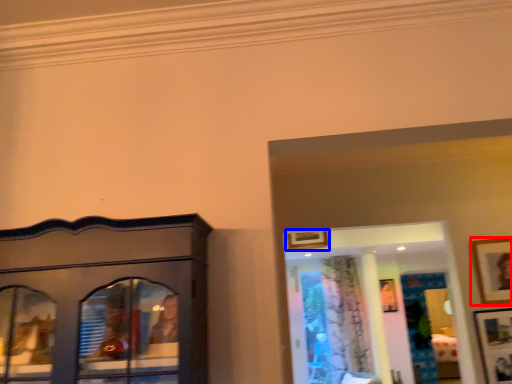
Question: Which object appears closest to the camera in this image, picture frame (highlighted by a red box) or picture frame (highlighted by a blue box)?

Choices:
 (A) picture frame
 (B) picture frame

Answer: (A)